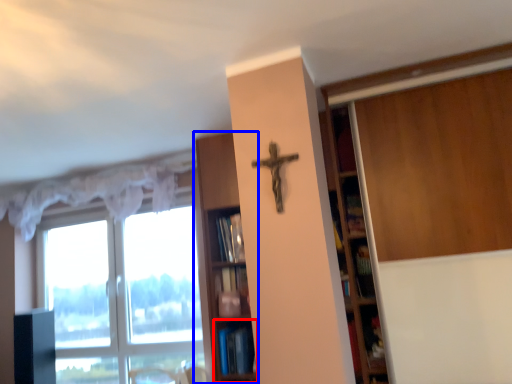
Question: Which point is further to the camera, shelf (highlighted by a red box) or shelf (highlighted by a blue box)?

Choices:
 (A) shelf
 (B) shelf

Answer: (A)